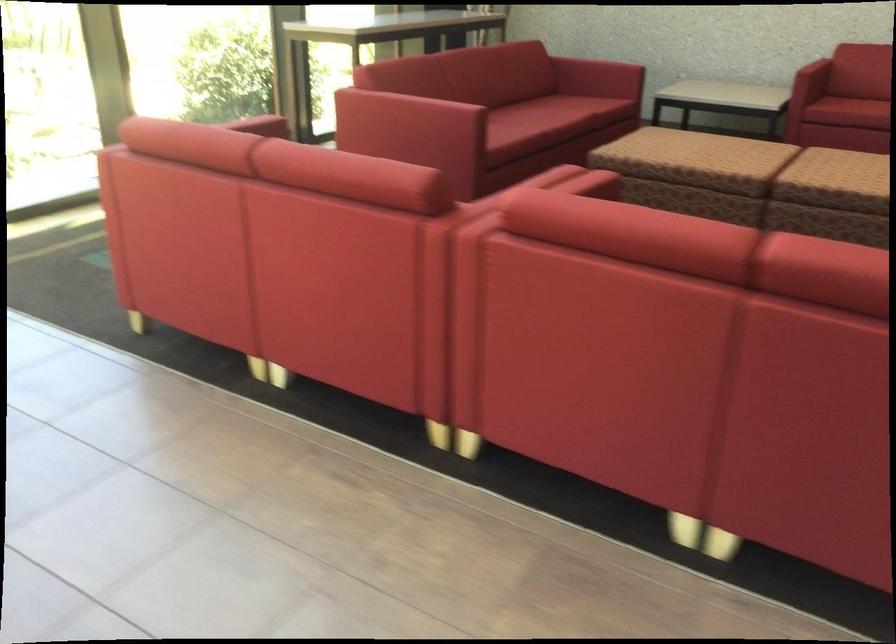
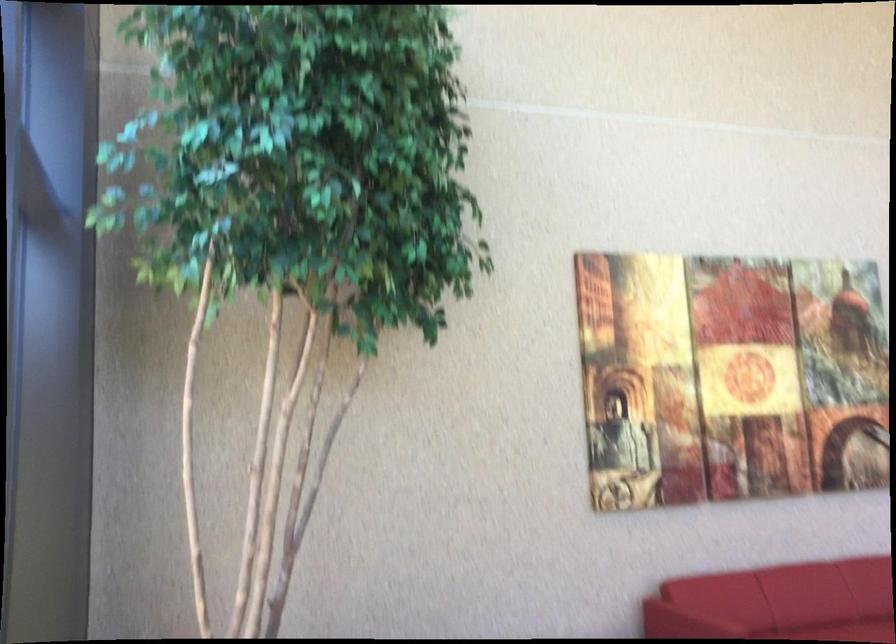
Question: The images are taken continuously from a first-person perspective. In which direction are you moving?

Choices:
 (A) Left
 (B) Right
 (C) Forward
 (D) Backward

Answer: (D)